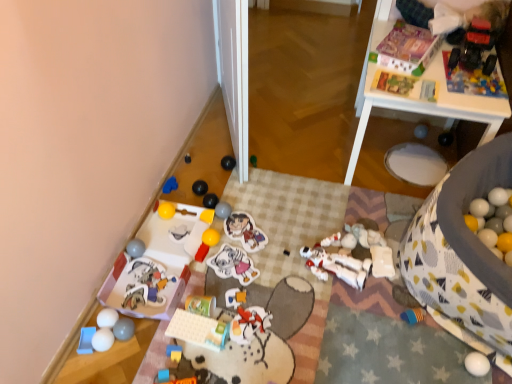
The height and width of the screenshot is (384, 512). Identify the location of vacant space in front of smooth plastic balls at lower left, the 23th toy when ordered from right to left. (117, 365).